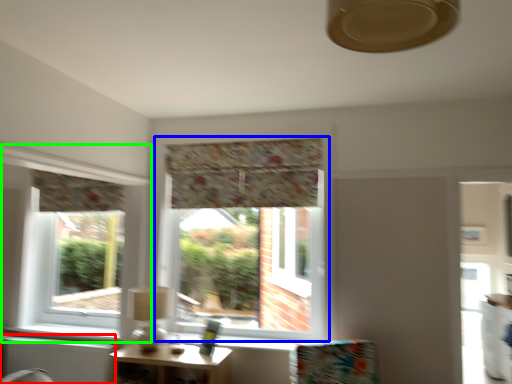
Question: Estimate the real-world distances between objects in this image. Which object is closer to radiator (highlighted by a red box), window (highlighted by a blue box) or window (highlighted by a green box)?

Choices:
 (A) window
 (B) window

Answer: (B)